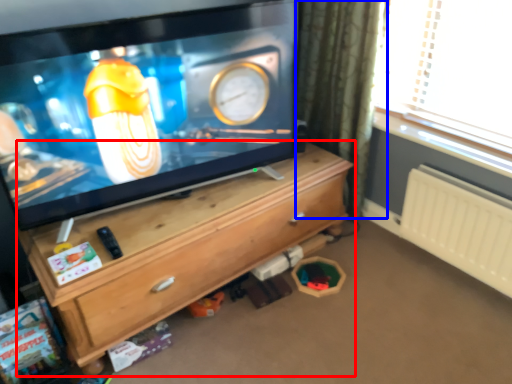
Question: Which object appears closest to the camera in this image, chest of drawers (highlighted by a red box) or curtain (highlighted by a blue box)?

Choices:
 (A) chest of drawers
 (B) curtain

Answer: (A)